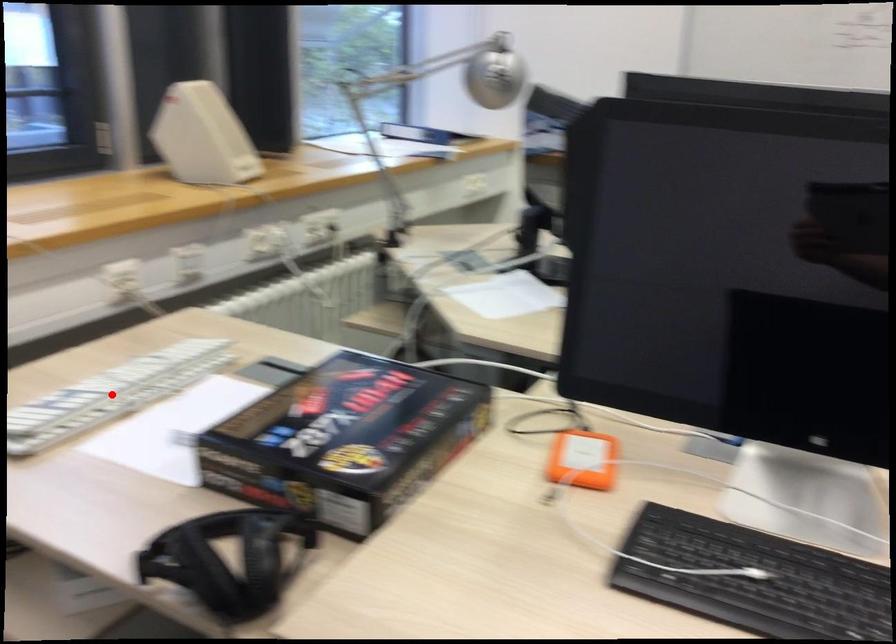
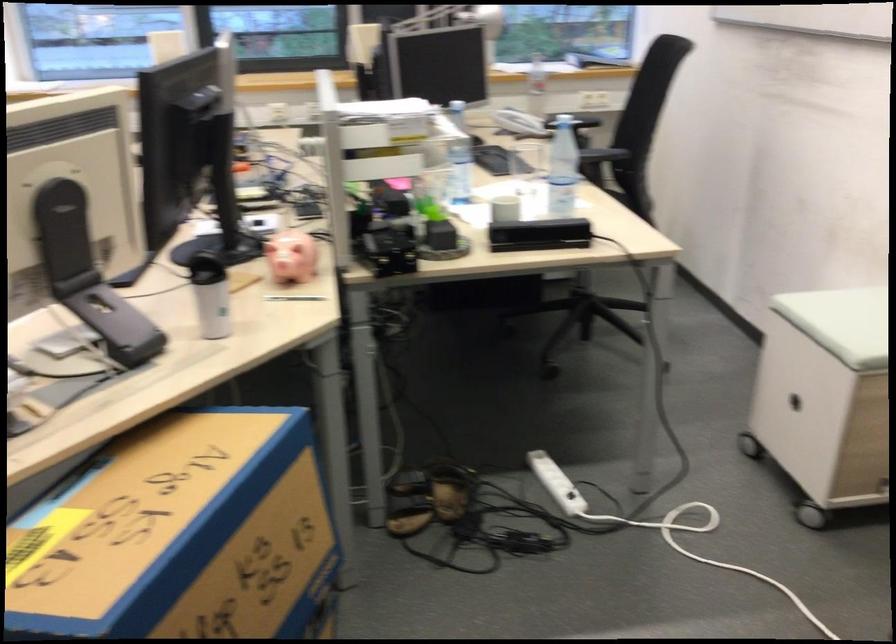
Question: I am providing you with two images of the same scene from different viewpoints. A red point is marked on the first image. Is the red point's position out of view in image 2?

Choices:
 (A) Yes
 (B) No

Answer: (A)